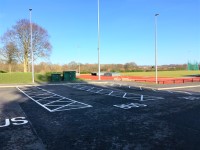
Locate an element on the screen. Image resolution: width=200 pixels, height=150 pixels. white paint is located at coordinates (58, 103), (24, 121), (130, 107), (127, 95), (187, 97), (131, 86).